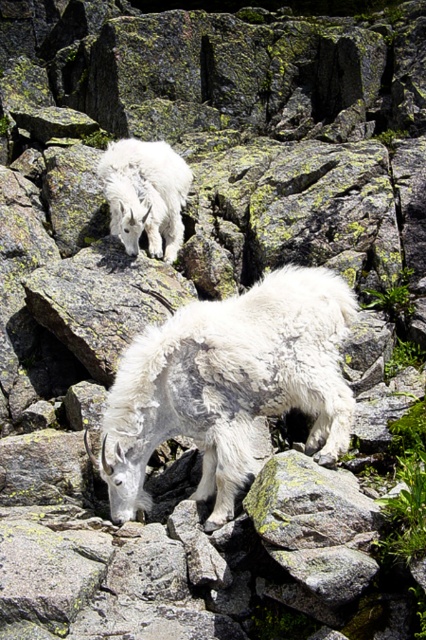
Describe the element at coordinates (229, 385) in the screenshot. I see `white woolen goat at center` at that location.

Does white woolen goat at center appear over white woolen goat at upper center?

No, white woolen goat at center is not above white woolen goat at upper center.

Does point (344, 392) come farther from viewer compared to point (166, 160)?

No, it is in front of (166, 160).

Where is `white woolen goat at center`? white woolen goat at center is located at coordinates (229, 385).